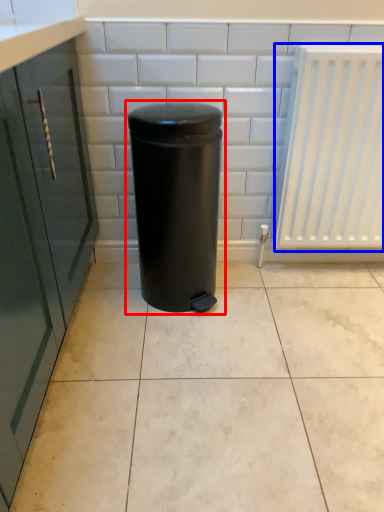
Question: Which object appears closest to the camera in this image, waste container (highlighted by a red box) or radiator (highlighted by a blue box)?

Choices:
 (A) waste container
 (B) radiator

Answer: (A)